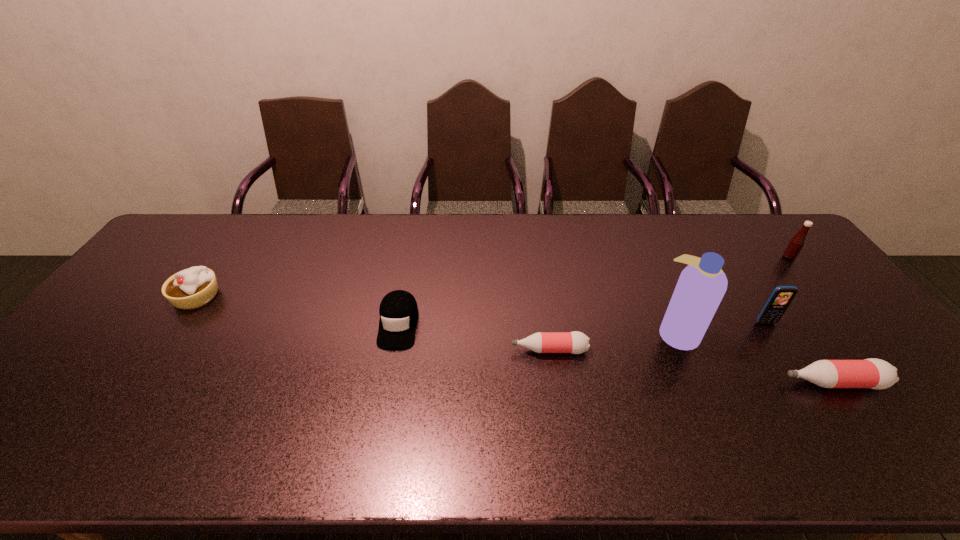
Please point a spot to add another bottle on the left. Please provide its 2D coordinates. Your answer should be formatted as a tuple, i.e. [(x, y)], where the tuple contains the x and y coordinates of a point satisfying the conditions above.

[(300, 321)]